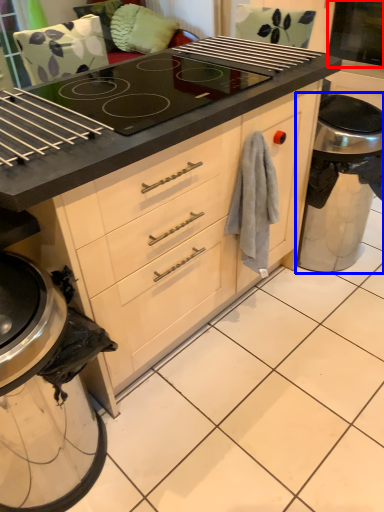
Question: Which object is closer to the camera taking this photo, screen door (highlighted by a red box) or appliance (highlighted by a blue box)?

Choices:
 (A) screen door
 (B) appliance

Answer: (B)